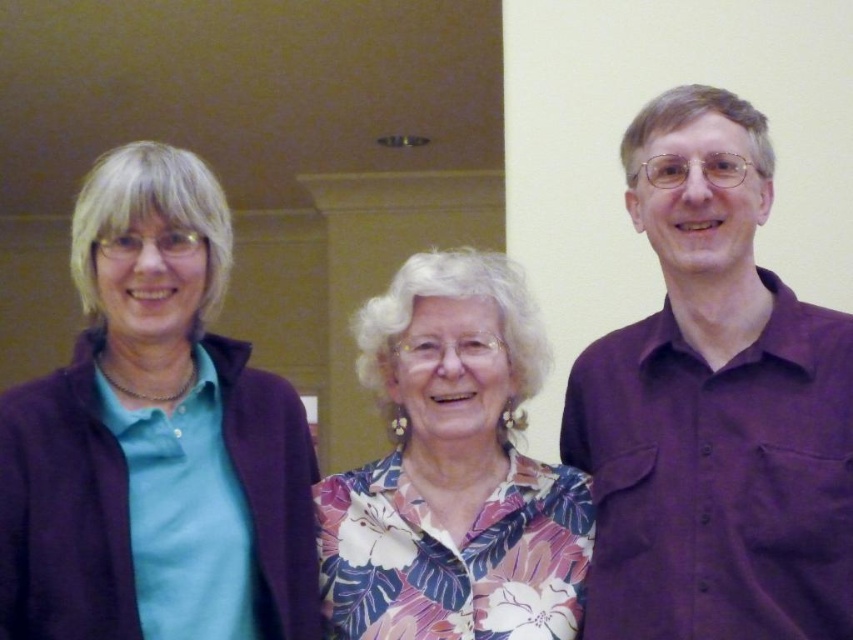
In the scene shown: Is purple cotton shirt at right positioned at the back of floral print blouse at center?

No, purple cotton shirt at right is closer to the viewer.

Does purple cotton shirt at right appear on the left side of floral print blouse at center?

In fact, purple cotton shirt at right is to the right of floral print blouse at center.

Does point (589, 419) come in front of point (442, 580)?

No, (589, 419) is behind (442, 580).

Locate an element on the screen. This screenshot has height=640, width=853. purple cotton shirt at right is located at coordinates (714, 406).

Looking at this image, is matte purple jacket at left positioned behind floral print blouse at center?

No.

Is point (25, 550) farther from camera compared to point (553, 625)?

That is False.

What do you see at coordinates (155, 438) in the screenshot?
I see `matte purple jacket at left` at bounding box center [155, 438].

You are a GUI agent. You are given a task and a screenshot of the screen. Output one action in this format:
    pyautogui.click(x=<x>, y=<y>)
    Task: Click on the matte purple jacket at left
    The width and height of the screenshot is (853, 640).
    Given the screenshot: What is the action you would take?
    pyautogui.click(x=155, y=438)

Which of these two, purple cotton shirt at right or matte purple jacket at left, stands shorter?

matte purple jacket at left is shorter.

In the scene shown: Who is positioned more to the right, purple cotton shirt at right or matte purple jacket at left?

purple cotton shirt at right is more to the right.

Does point (697, 406) come closer to viewer compared to point (172, 225)?

No, (697, 406) is behind (172, 225).

In order to click on purple cotton shirt at right in this screenshot , I will do `click(714, 406)`.